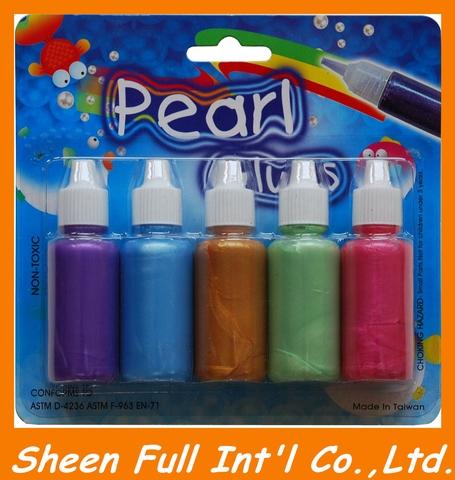
What are the coordinates of `bottles of colored glues` in the screenshot? It's located at (84, 337), (158, 335), (224, 336), (310, 333), (385, 327).